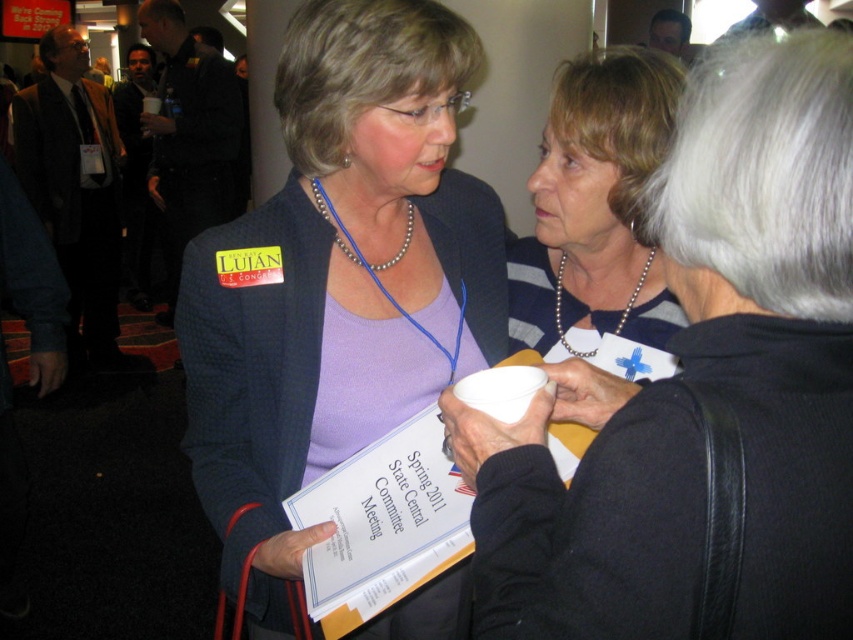
Question: Among these objects, which one is nearest to the camera?

Choices:
 (A) matte black blazer at center
 (B) matte white cup at center

Answer: (B)

Question: Observing the image, what is the correct spatial positioning of matte white cup at center in reference to matte black blazer at center?

Choices:
 (A) below
 (B) above

Answer: (B)

Question: Which object appears closest to the camera in this image?

Choices:
 (A) matte white cup at center
 (B) pearl necklace at center
 (C) matte black blazer at center

Answer: (A)

Question: Is the position of matte white cup at center less distant than that of pearl necklace at center?

Choices:
 (A) no
 (B) yes

Answer: (B)

Question: Is matte white cup at center further to camera compared to pearl necklace at center?

Choices:
 (A) yes
 (B) no

Answer: (B)

Question: Which point appears farthest from the camera in this image?

Choices:
 (A) (445, 580)
 (B) (631, 291)

Answer: (A)